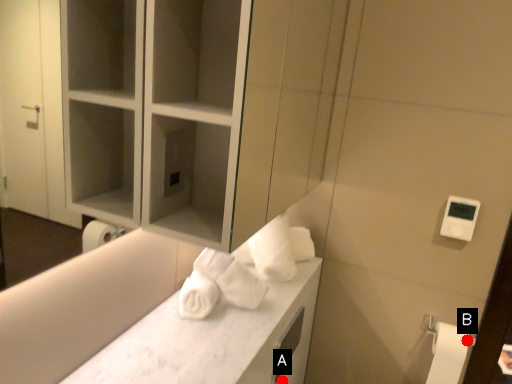
Question: Two points are circled on the image, labeled by A and B beside each circle. Which point is closer to the camera?

Choices:
 (A) A is closer
 (B) B is closer

Answer: (B)